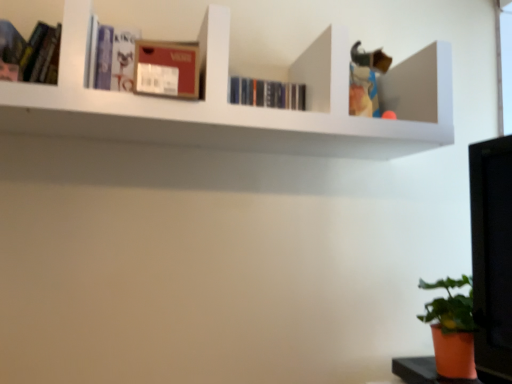
Question: Considering the positions of matte cardboard box at upper center and orange matte pot at lower right in the image, is matte cardboard box at upper center wider or thinner than orange matte pot at lower right?

Choices:
 (A) thin
 (B) wide

Answer: (B)

Question: From the image's perspective, is matte cardboard box at upper center positioned above or below orange matte pot at lower right?

Choices:
 (A) above
 (B) below

Answer: (A)

Question: Which object is positioned closest to the orange matte pot at lower right?

Choices:
 (A) matte black book at upper left, arranged as the 2th book when viewed from the back
 (B) matte cardboard box at upper center
 (C) white matte shelf at upper center
 (D) matte purple book at upper left, the second book viewed from the left

Answer: (C)

Question: Which object is the closest to the matte cardboard box at upper center?

Choices:
 (A) matte black book at upper left, placed as the second book when sorted from right to left
 (B) orange matte pot at lower right
 (C) matte purple book at upper left, the first book viewed from the right
 (D) white matte shelf at upper center

Answer: (C)